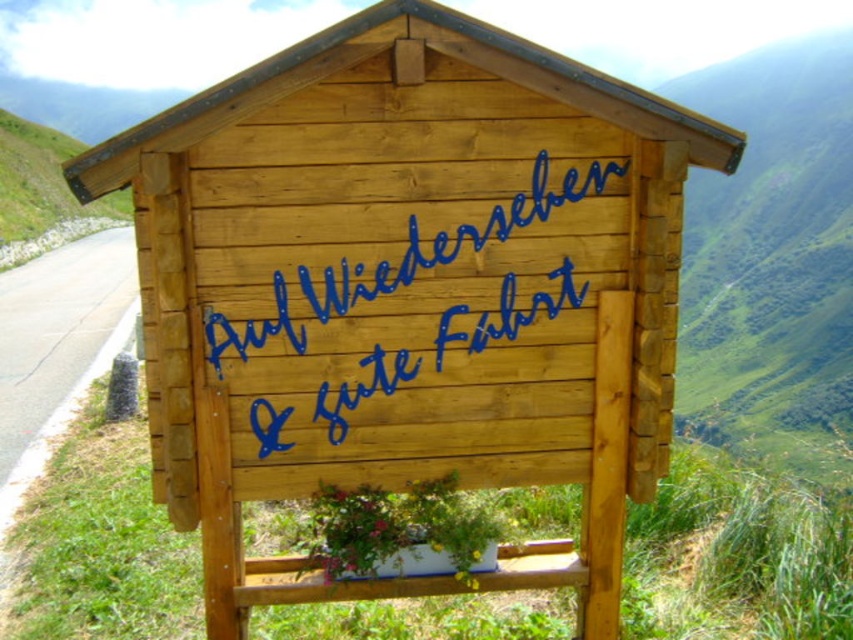
Does point (815, 403) come farther from viewer compared to point (552, 211)?

Yes, point (815, 403) is farther from viewer.

Does green grassy hillside at upper right come in front of blue painted wood sign at center?

That is True.

Is point (833, 136) behind point (524, 211)?

Yes, point (833, 136) is behind point (524, 211).

Locate an element on the screen. green grassy hillside at upper right is located at coordinates (772, 260).

Who is positioned more to the right, blue painted wood sign at center or asphalt road at left?

blue painted wood sign at center

Between blue painted wood sign at center and asphalt road at left, which one is positioned lower?

blue painted wood sign at center is below.

Locate an element on the screen. This screenshot has width=853, height=640. blue painted wood sign at center is located at coordinates (397, 264).

Looking at this image, which is more to the left, green grassy hillside at upper right or asphalt road at left?

asphalt road at left is more to the left.

Is green grassy hillside at upper right positioned before asphalt road at left?

That is True.

Find the location of a particular element. green grassy hillside at upper right is located at coordinates (772, 260).